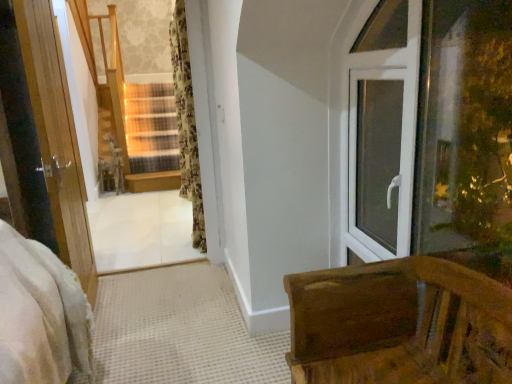
In order to click on empty space that is ontop of white plastic window at right (from a real-world perspective) in this screenshot , I will do (x=369, y=63).